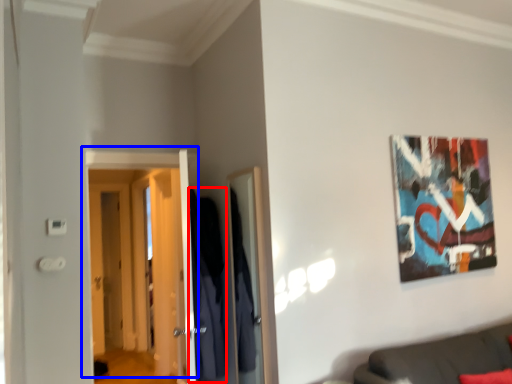
Question: Which point is further to the camera, robe (highlighted by a red box) or door (highlighted by a blue box)?

Choices:
 (A) robe
 (B) door

Answer: (B)